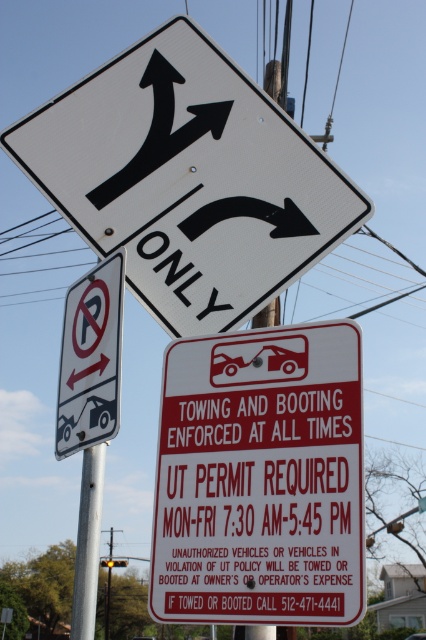
Does red plastic sign at center appear on the left side of silver metallic pole at center?

Incorrect, red plastic sign at center is not on the left side of silver metallic pole at center.

Does red plastic sign at center appear under silver metallic pole at center?

Incorrect, red plastic sign at center is not positioned below silver metallic pole at center.

Does point (178, 611) lie in front of point (95, 467)?

Yes, point (178, 611) is closer to viewer.

The height and width of the screenshot is (640, 426). Identify the location of red plastic sign at center. (261, 477).

Does white plastic sign at upper center appear on the right side of red plastic sign at center?

In fact, white plastic sign at upper center is to the left of red plastic sign at center.

This screenshot has height=640, width=426. Describe the element at coordinates (187, 179) in the screenshot. I see `white plastic sign at upper center` at that location.

I want to click on white plastic sign at upper center, so click(187, 179).

Consider the image. Can you confirm if red plastic sign at center is smaller than metallic silver car at center?

Indeed, red plastic sign at center has a smaller size compared to metallic silver car at center.

From the picture: Is red plastic sign at center wider than metallic silver car at center?

No, red plastic sign at center is not wider than metallic silver car at center.

Which is behind, point (176, 460) or point (414, 634)?

Positioned behind is point (414, 634).

Locate an element on the screen. The image size is (426, 640). red plastic sign at center is located at coordinates (261, 477).